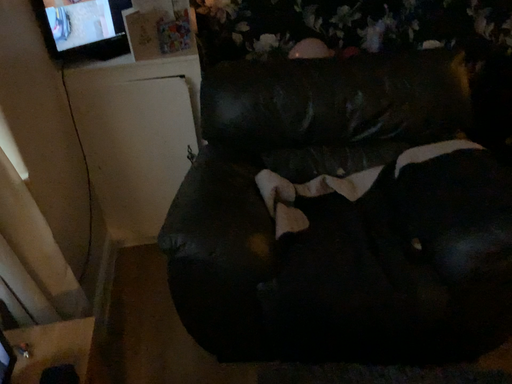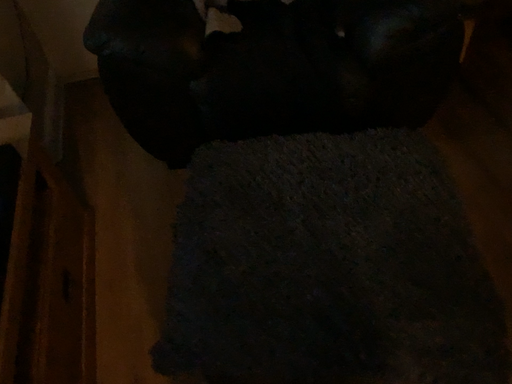
Question: Which way did the camera rotate in the video?

Choices:
 (A) rotated downward
 (B) rotated upward

Answer: (A)